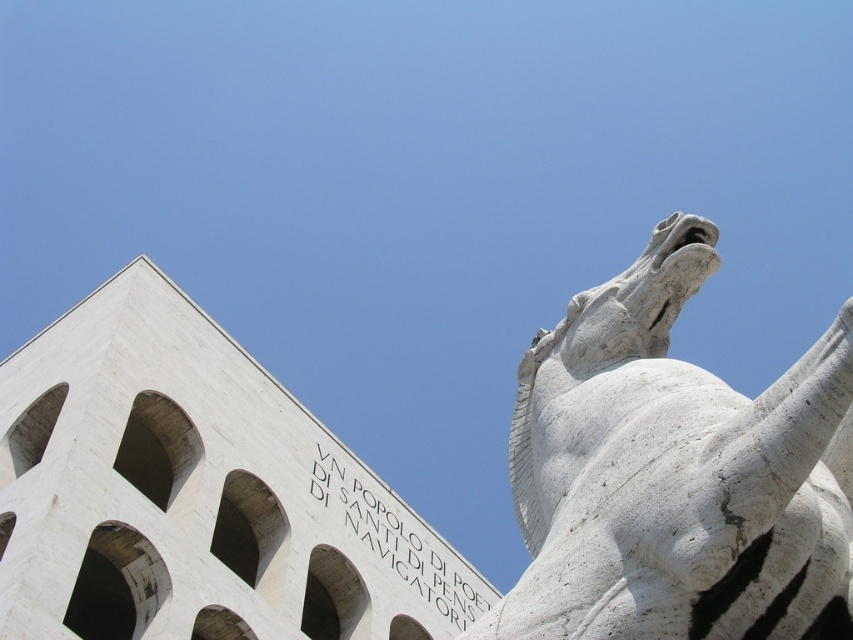
Who is positioned more to the left, white marble horse at upper right or white stone text at upper center?

white stone text at upper center is more to the left.

Does white marble horse at upper right have a lesser width compared to white stone text at upper center?

Indeed, white marble horse at upper right has a lesser width compared to white stone text at upper center.

Between point (840, 484) and point (422, 589), which one is positioned in front?

Point (840, 484) is in front.

Locate an element on the screen. This screenshot has height=640, width=853. white marble horse at upper right is located at coordinates (675, 474).